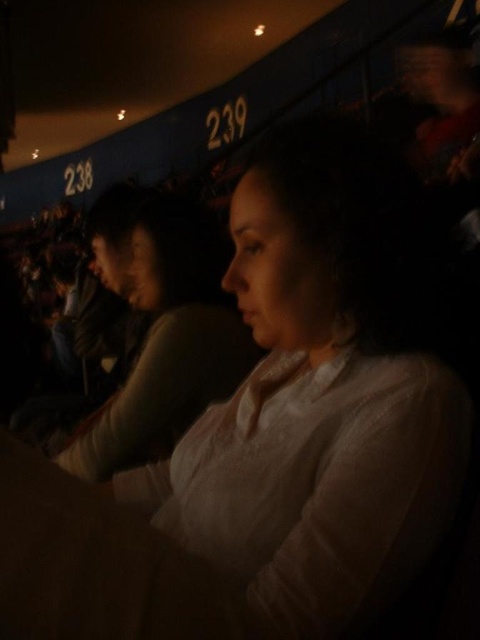
At what (x,y) coordinates should I click in order to perform the action: click on white matte shirt at center. Please return your answer as a coordinate pair (x, y). The height and width of the screenshot is (640, 480). Looking at the image, I should click on (325, 394).

At what (x,y) coordinates should I click in order to perform the action: click on white matte shirt at center. Please return your answer as a coordinate pair (x, y). Looking at the image, I should click on (325, 394).

I want to click on white matte shirt at center, so click(x=325, y=394).